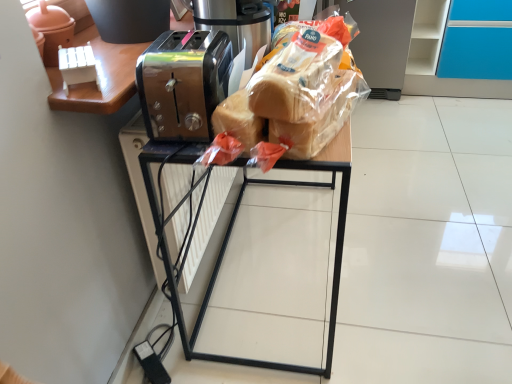
Question: Do you think translucent plastic bread at center is within metallic toaster at center, or outside of it?

Choices:
 (A) inside
 (B) outside

Answer: (B)

Question: From a real-world perspective, is translucent plastic bread at center above or below metallic toaster at center?

Choices:
 (A) above
 (B) below

Answer: (B)

Question: Based on their relative distances, which object is farther from the metallic toaster at center?

Choices:
 (A) translucent plastic bread at center
 (B) translucent plastic bread at center, the first bread positioned from the top
 (C) translucent plastic bread at center, the 1th bread from the bottom

Answer: (A)

Question: Which object is the closest to the translucent plastic bread at center, arranged as the second bread when ordered from the bottom?

Choices:
 (A) metallic toaster at center
 (B) translucent plastic bread at center
 (C) translucent plastic bread at center, which is the second bread in top-to-bottom order

Answer: (C)